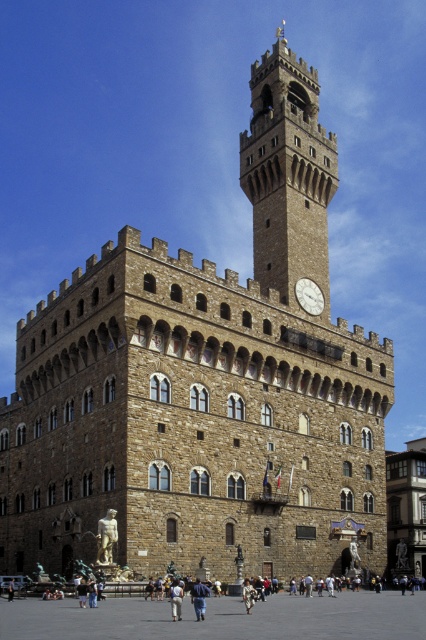
You are a tourist standing in front of the grand historical building. You see the white stone clock at center and the white fabric bag at lower center. Which object is closer to you?

The white fabric bag at lower center is behind the white stone clock at center, so the white stone clock at center is closer to you.

You are an architect examining the building and need to determine the relative sizes of two elements. Which object has a greater width between the white stone clock at center and the white fabric bag at lower center?

The white stone clock at center has a greater width than the white fabric bag at lower center.